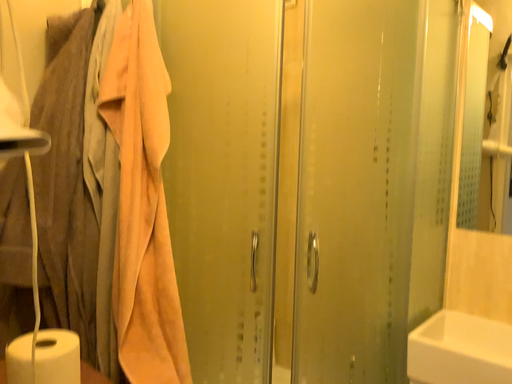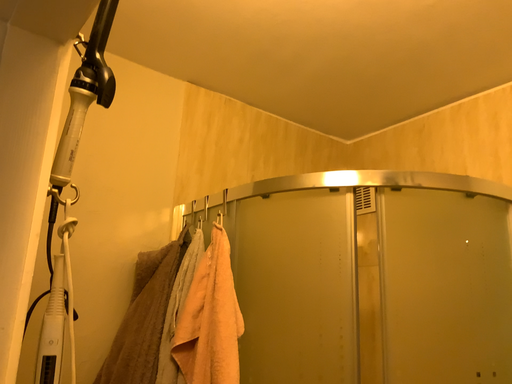
Question: Which way did the camera rotate in the video?

Choices:
 (A) rotated right
 (B) rotated left

Answer: (B)